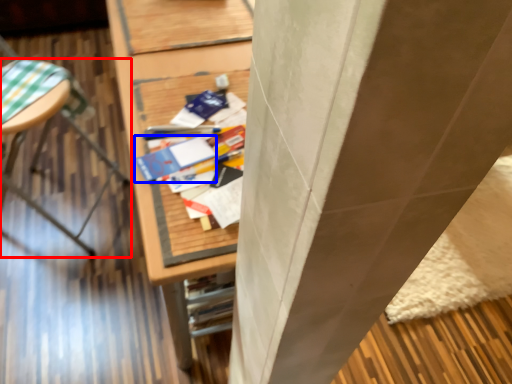
Question: Which of the following is the closest to the observer, furniture (highlighted by a red box) or paperback book (highlighted by a blue box)?

Choices:
 (A) furniture
 (B) paperback book

Answer: (B)